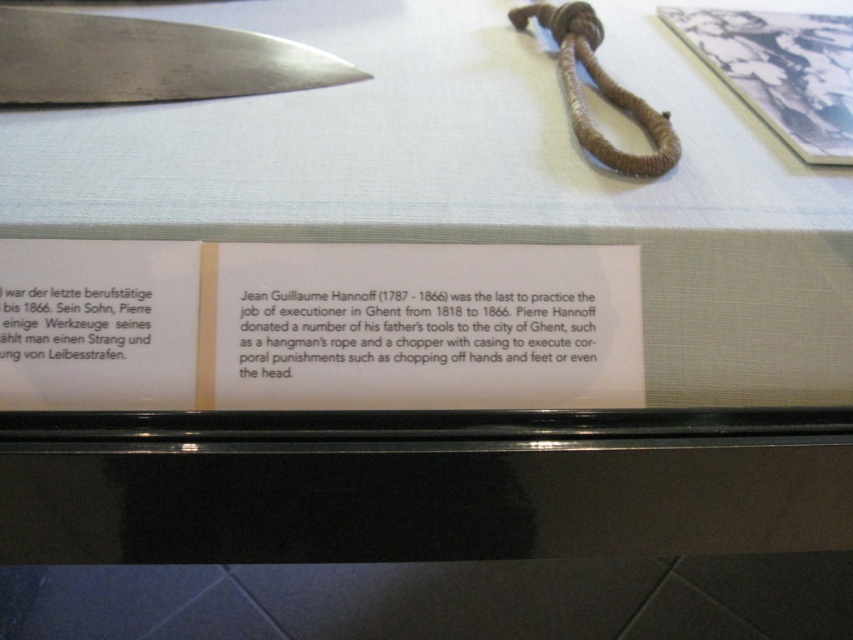
At what (x,y) coordinates should I click in order to perform the action: click on polished metal knife at upper left. Please return your answer as a coordinate pair (x, y). Looking at the image, I should click on (148, 60).

Can you confirm if polished metal knife at upper left is positioned to the left of brown woven rope at upper center?

Indeed, polished metal knife at upper left is positioned on the left side of brown woven rope at upper center.

This screenshot has width=853, height=640. What do you see at coordinates (148, 60) in the screenshot?
I see `polished metal knife at upper left` at bounding box center [148, 60].

I want to click on polished metal knife at upper left, so click(148, 60).

In the scene shown: Can you confirm if black paper at center is positioned below black paper at lower left?

Yes, black paper at center is below black paper at lower left.

Locate an element on the screen. black paper at center is located at coordinates (410, 328).

What are the coordinates of `black paper at center` in the screenshot? It's located at (410, 328).

In the scene shown: Which is more to the right, black paper at center or polished metal knife at upper left?

black paper at center

Between black paper at center and polished metal knife at upper left, which one is positioned lower?

black paper at center is below.

Is point (558, 323) positioned behind point (235, 51)?

No, it is not.

Where is `black paper at center`? black paper at center is located at coordinates (410, 328).